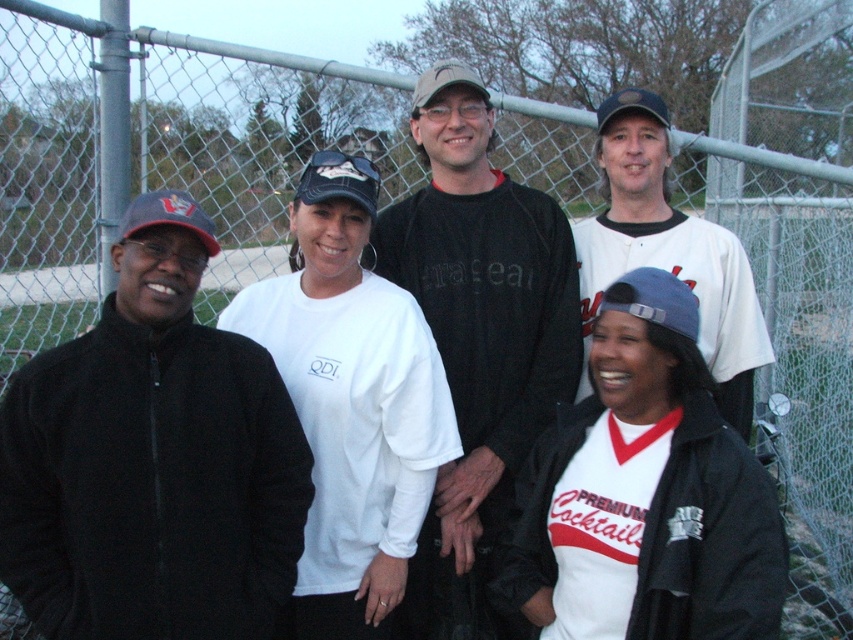
Question: Does white jersey at lower center have a smaller size compared to white jersey at center?

Choices:
 (A) no
 (B) yes

Answer: (B)

Question: Which of the following is the farthest from the observer?

Choices:
 (A) white cotton t-shirt at center
 (B) black fabric baseball cap at center
 (C) white jersey at lower center
 (D) black fleece jacket at left

Answer: (B)

Question: Is blue fabric baseball cap at center further to camera compared to black fabric baseball cap at center?

Choices:
 (A) yes
 (B) no

Answer: (B)

Question: From the image, what is the correct spatial relationship of white cotton t-shirt at center in relation to white jersey at lower center?

Choices:
 (A) below
 (B) above

Answer: (B)

Question: Which object is farther from the camera taking this photo?

Choices:
 (A) white jersey at center
 (B) camouflage fabric baseball cap at center
 (C) black fabric baseball cap at upper center
 (D) black fleece jacket at left

Answer: (C)

Question: Which object appears closest to the camera in this image?

Choices:
 (A) white cotton t-shirt at center
 (B) white jersey at center
 (C) black fleece at center
 (D) black fleece jacket at left

Answer: (D)